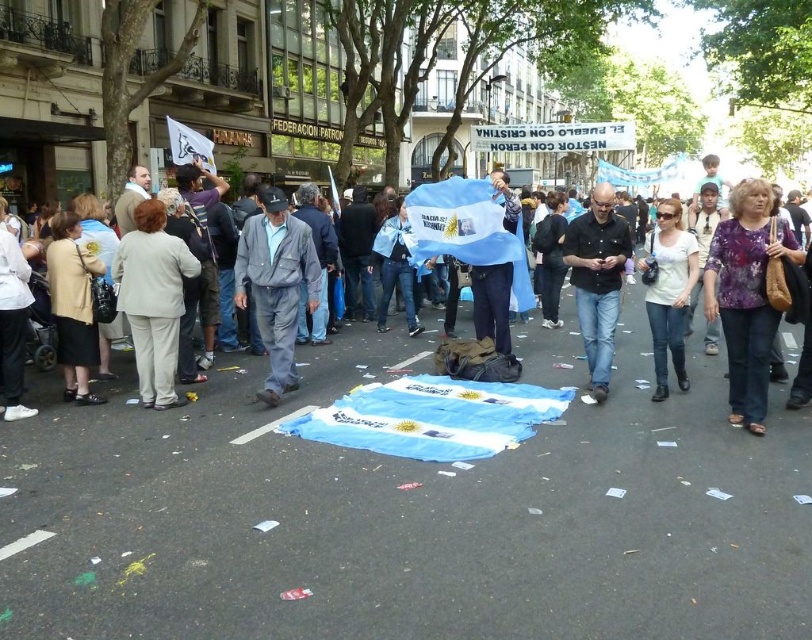
Based on the photo, is purple printed blouse at center further to the viewer compared to matte gray suit at center?

No.

Is purple printed blouse at center bigger than matte gray suit at center?

No, purple printed blouse at center is not bigger than matte gray suit at center.

Is point (754, 332) farther from camera compared to point (266, 310)?

That is False.

I want to click on purple printed blouse at center, so click(746, 294).

Which of these two, matte gray suit at center or black shirt at center, stands taller?

With more height is matte gray suit at center.

Between point (288, 330) and point (597, 264), which one is positioned behind?

Positioned behind is point (288, 330).

Does point (266, 390) lie behind point (615, 289)?

No, it is in front of (615, 289).

Image resolution: width=812 pixels, height=640 pixels. In order to click on matte gray suit at center in this screenshot , I will do `click(275, 284)`.

Does point (731, 296) lie in front of point (189, 273)?

Yes, point (731, 296) is closer to viewer.

Can you confirm if purple printed blouse at center is bigger than light beige pants at left?

Indeed, purple printed blouse at center has a larger size compared to light beige pants at left.

The image size is (812, 640). What do you see at coordinates (746, 294) in the screenshot?
I see `purple printed blouse at center` at bounding box center [746, 294].

Where is `purple printed blouse at center`? The image size is (812, 640). purple printed blouse at center is located at coordinates (746, 294).